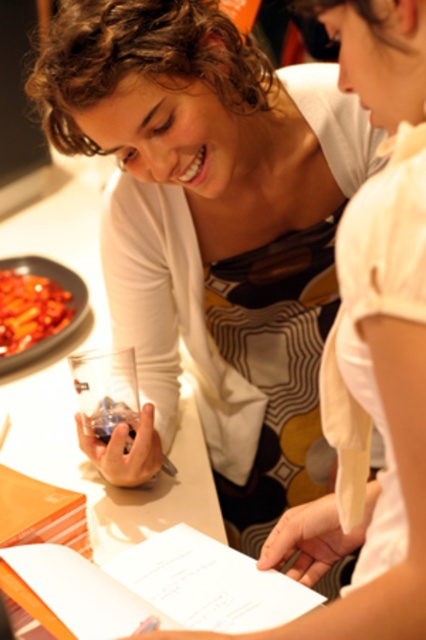
Question: Is patterned fabric apron at center wider than smooth glossy red sauce at left?

Choices:
 (A) yes
 (B) no

Answer: (B)

Question: Does patterned fabric apron at center appear on the right side of smooth glossy red sauce at left?

Choices:
 (A) no
 (B) yes

Answer: (B)

Question: Is patterned fabric apron at center wider than smooth glossy red sauce at left?

Choices:
 (A) no
 (B) yes

Answer: (A)

Question: Which object appears closest to the camera in this image?

Choices:
 (A) patterned fabric apron at center
 (B) clear glass at center
 (C) smooth glossy red sauce at left

Answer: (B)

Question: Which object is closer to the camera taking this photo?

Choices:
 (A) clear glass at center
 (B) smooth glossy red sauce at left
 (C) patterned fabric apron at center

Answer: (A)

Question: Which of the following is the closest to the observer?

Choices:
 (A) clear glass at center
 (B) smooth glossy red sauce at left

Answer: (A)